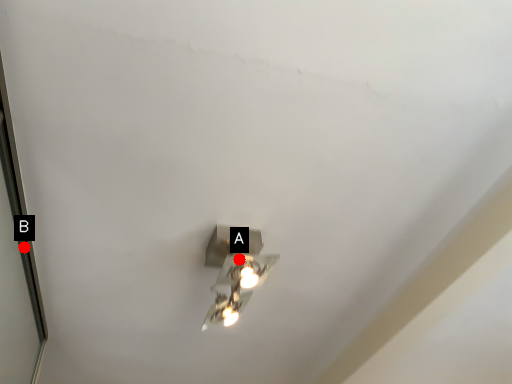
Question: Two points are circled on the image, labeled by A and B beside each circle. Which point is closer to the camera?

Choices:
 (A) A is closer
 (B) B is closer

Answer: (A)